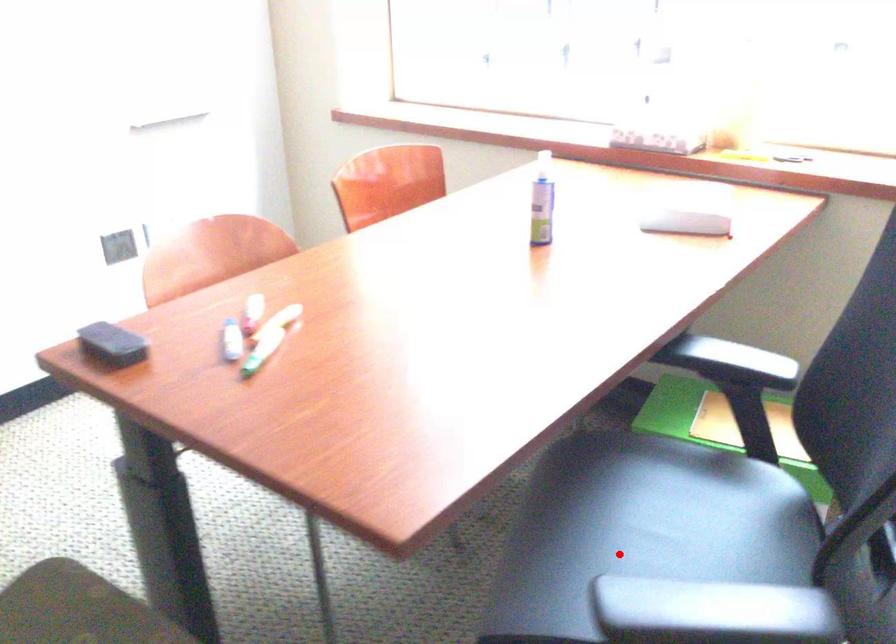
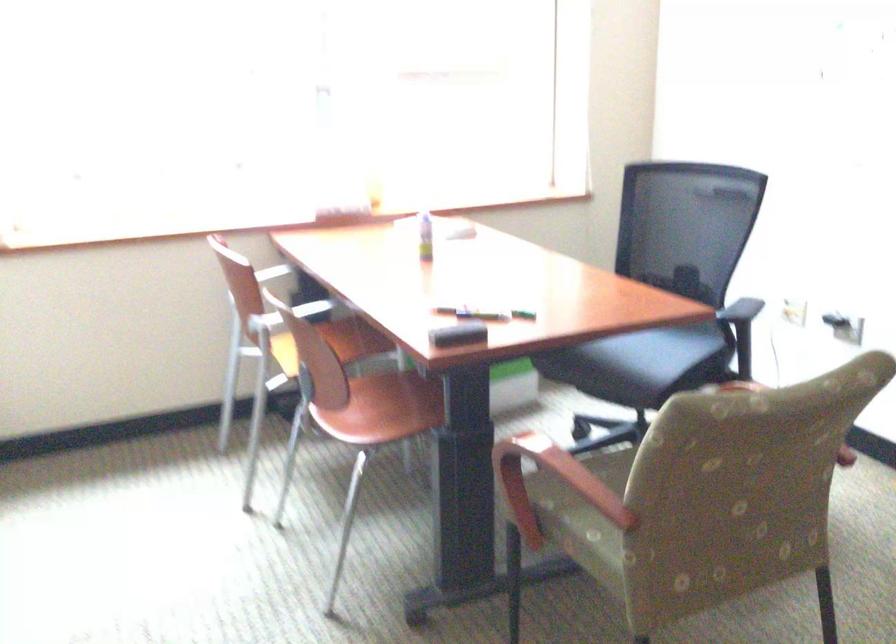
Question: I am providing you with two images of the same scene from different viewpoints. Given a red point in image1, look at the same physical point in image2. Is it:

Choices:
 (A) Closer to the viewpoint
 (B) Farther from the viewpoint

Answer: (B)